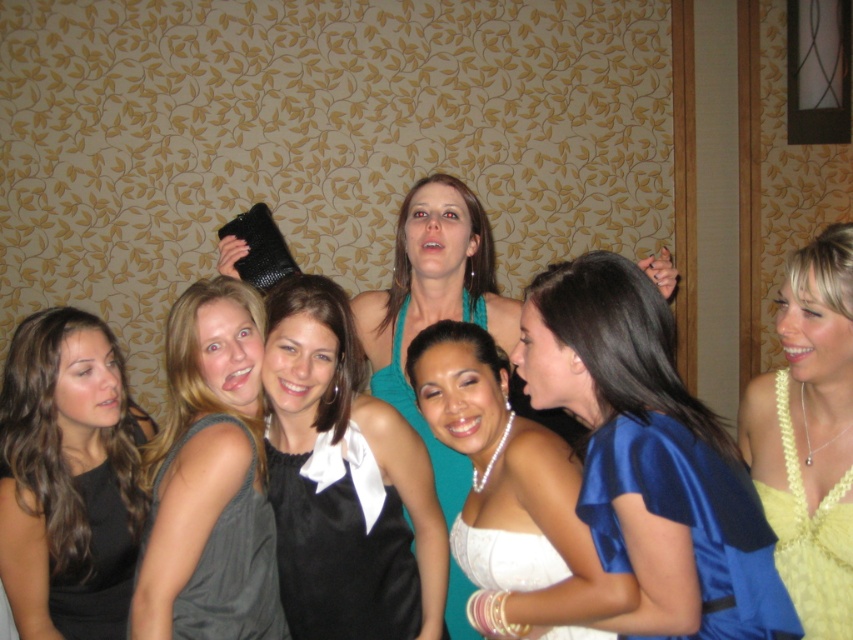
Question: Which of the following is the farthest from the observer?

Choices:
 (A) teal satin dress at center
 (B) black satin dress at left
 (C) satin blue dress at center
 (D) pearl necklace at center

Answer: (B)

Question: Does satin blue dress at center appear under white satin dress at center?

Choices:
 (A) no
 (B) yes

Answer: (A)

Question: Is matte gray dress at center closer to camera compared to black satin dress at center?

Choices:
 (A) no
 (B) yes

Answer: (B)

Question: Which point is closer to the camera?

Choices:
 (A) matte gray dress at center
 (B) black satin dress at left
 (C) white satin dress at center

Answer: (C)

Question: Can you confirm if matte gray dress at center is positioned below yellow knitted dress at upper right?

Choices:
 (A) yes
 (B) no

Answer: (A)

Question: Which object is the closest to the yellow knitted dress at upper right?

Choices:
 (A) white satin dress at center
 (B) pearl necklace at center
 (C) teal satin dress at center
 (D) black satin dress at left

Answer: (B)